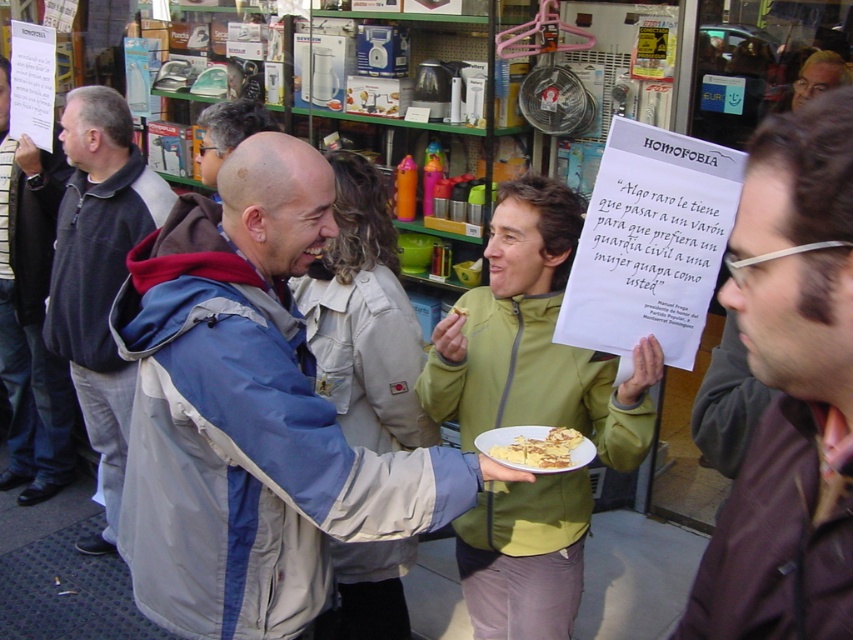
Which is more to the right, blue fabric jacket at center or dark blue jacket at center?

blue fabric jacket at center is more to the right.

Is point (94, 248) positioned after point (33, 227)?

No, it is not.

Which is in front, point (74, 93) or point (3, 193)?

Point (74, 93) is in front.

This screenshot has width=853, height=640. I want to click on blue fabric jacket at center, so click(x=99, y=273).

Who is taller, brown leather jacket at center or smooth brown hair at upper right?

brown leather jacket at center

Describe the element at coordinates (788, 390) in the screenshot. I see `brown leather jacket at center` at that location.

This screenshot has height=640, width=853. In order to click on brown leather jacket at center in this screenshot , I will do `click(788, 390)`.

Where is `brown leather jacket at center`? brown leather jacket at center is located at coordinates (788, 390).

Which of these two, brown leather jacket at center or golden crumbly cake at center, stands taller?

brown leather jacket at center

Does brown leather jacket at center have a greater height compared to golden crumbly cake at center?

Yes.

Locate an element on the screen. This screenshot has height=640, width=853. brown leather jacket at center is located at coordinates (788, 390).